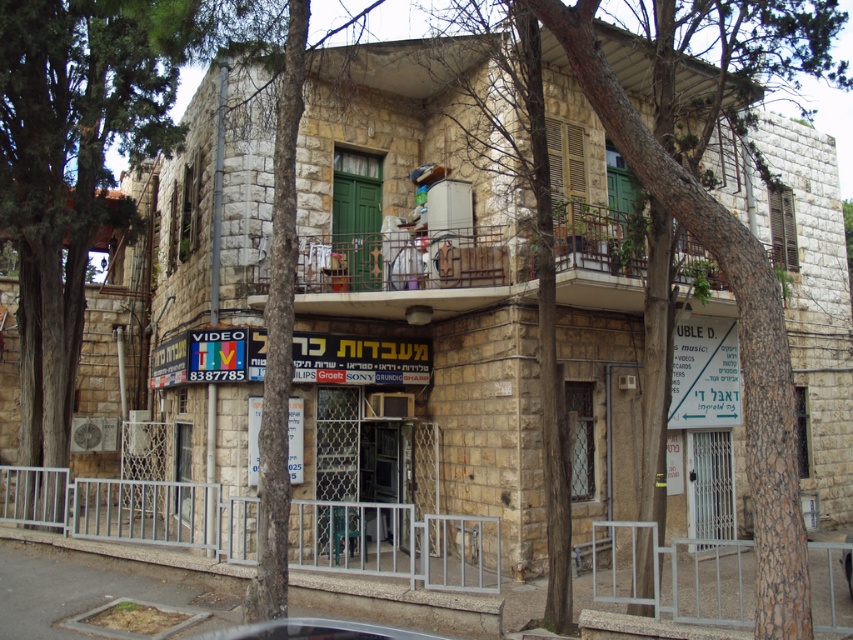
You are a pedestrian standing in front of the shop with the signboard. You want to cross the street to reach the park on the other side. Is the metallic silver car at center blocking your path to the green leafy tree at left?

The metallic silver car at center is behind green leafy tree at left, so the car is not blocking your path to the green leafy tree at left because it is positioned behind it.

You are a delivery driver who needs to park the metallic silver car at center as close as possible to the green leafy tree at left without hitting it. What is the minimum distance you should keep between them?

The green leafy tree at left might be wider than metallic silver car at center, so you should keep at least the width of the metallic silver car at center as the minimum distance to avoid collision.

You are standing at the point marked by the coordinates point (x=67, y=177). What object is located at this point?

The green leafy tree at left is located at point (x=67, y=177).